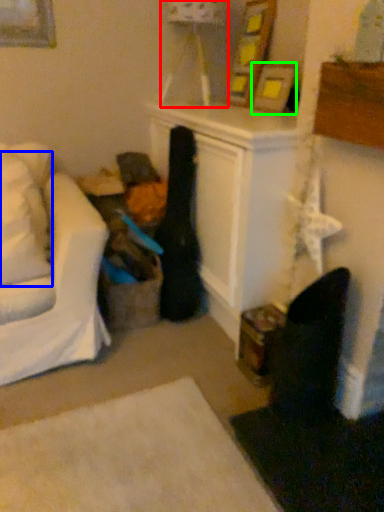
Question: Based on their relative distances, which object is farther from lamp (highlighted by a red box)? Choose from pillow (highlighted by a blue box) and picture frame (highlighted by a green box).

Choices:
 (A) pillow
 (B) picture frame

Answer: (A)